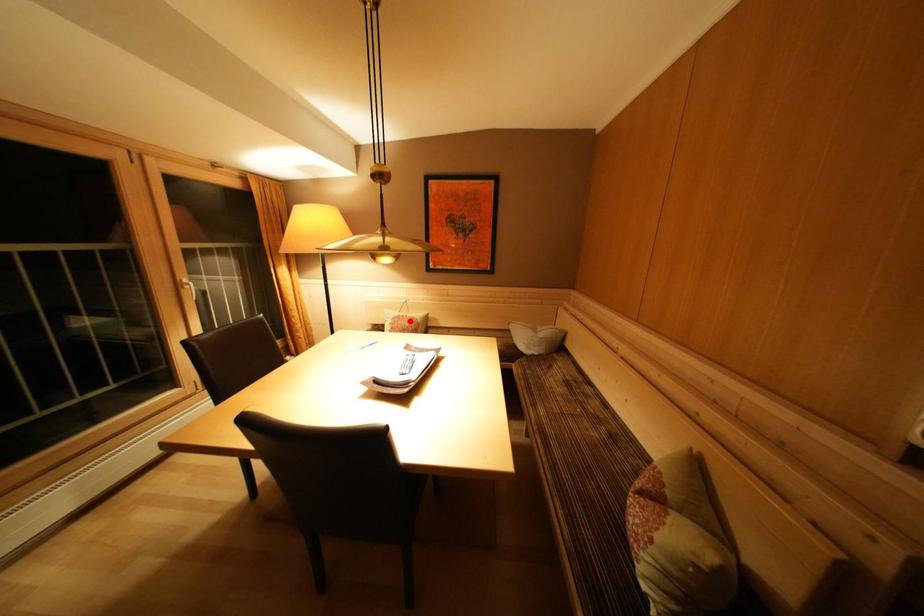
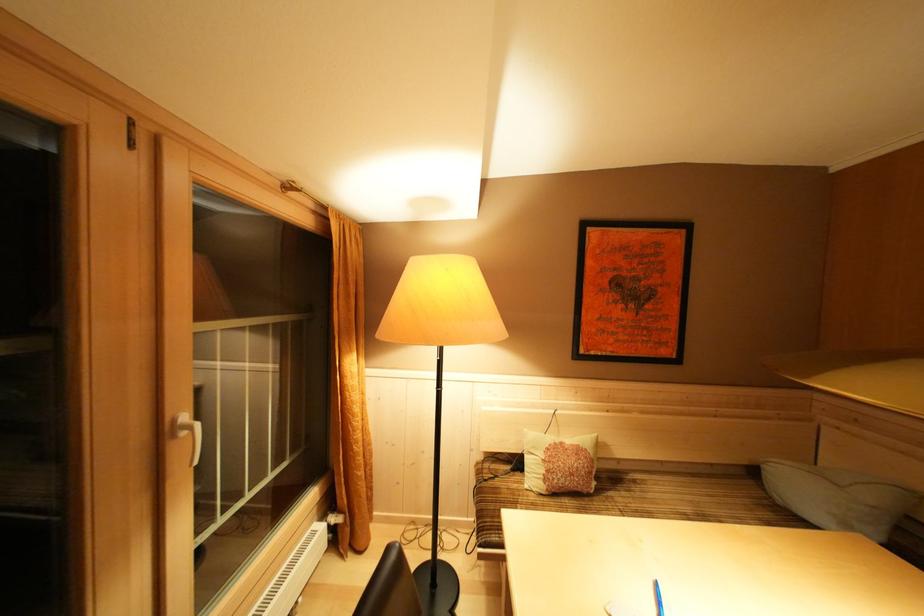
Question: A red point is marked in image1. In image2, is the corresponding 3D point closer to the camera or farther? Reply with the corresponding letter.

Choices:
 (A) The corresponding 3D point is closer.
 (B) The corresponding 3D point is farther.

Answer: (B)